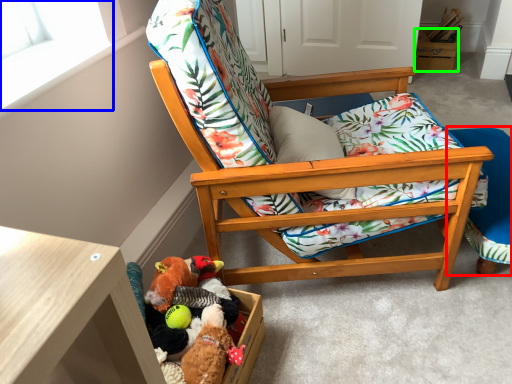
Question: Considering the real-world distances, which object is closest to folding chair (highlighted by a red box)? window screen (highlighted by a blue box) or storage box (highlighted by a green box).

Choices:
 (A) window screen
 (B) storage box

Answer: (A)